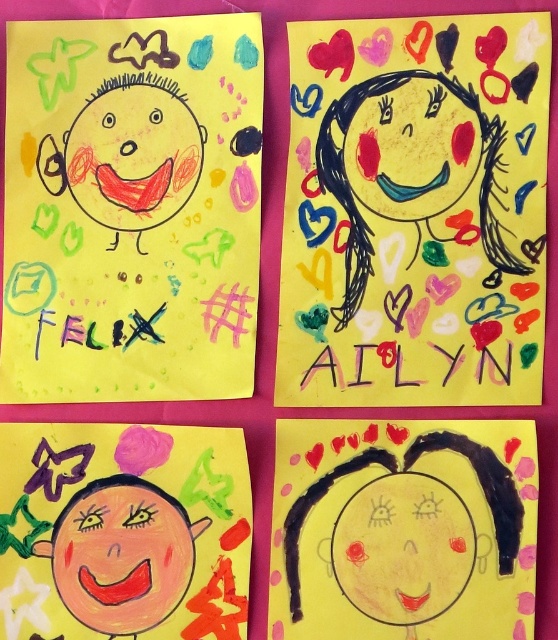
Question: Which object appears closest to the camera in this image?

Choices:
 (A) smooth yellow face at center
 (B) black marker text at upper center
 (C) smooth yellow face at upper center

Answer: (A)

Question: Does smooth yellow face at upper right appear on the left side of yellow matte face at center?

Choices:
 (A) no
 (B) yes

Answer: (A)

Question: Can you confirm if pink matte face at center is wider than smooth yellow face at center?

Choices:
 (A) no
 (B) yes

Answer: (B)

Question: Which point is closer to the camera?

Choices:
 (A) (426, 570)
 (B) (448, 595)
 (C) (93, 608)
 (D) (152, 113)

Answer: (B)

Question: Can you confirm if smooth yellow face at upper right is bigger than pink matte face at center?

Choices:
 (A) no
 (B) yes

Answer: (B)

Question: Which object is positioned closest to the pink matte face at center?

Choices:
 (A) black marker text at upper center
 (B) yellow matte face at center

Answer: (B)